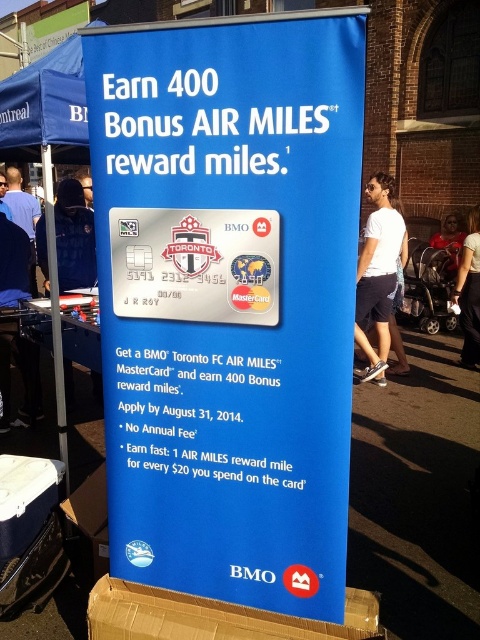
Who is positioned more to the left, black fabric at left or matte black hair at upper left?

From the viewer's perspective, matte black hair at upper left appears more on the left side.

Is black fabric at left positioned before matte black hair at upper left?

That is True.

Find the location of a particular element. This screenshot has height=640, width=480. black fabric at left is located at coordinates (73, 237).

Between metallic silver card at center and blue fabric canopy at upper left, which one is positioned lower?

metallic silver card at center

This screenshot has height=640, width=480. I want to click on metallic silver card at center, so click(x=195, y=264).

This screenshot has height=640, width=480. Find the location of `metallic silver card at center`. metallic silver card at center is located at coordinates pyautogui.click(x=195, y=264).

Is blue fabric canopy at upper left closer to the viewer compared to matte black jacket at left?

Yes.

Can you confirm if blue fabric canopy at upper left is bigger than matte black jacket at left?

No, blue fabric canopy at upper left is not bigger than matte black jacket at left.

You are a GUI agent. You are given a task and a screenshot of the screen. Output one action in this format:
    pyautogui.click(x=<x>, y=<y>)
    Task: Click on the blue fabric canopy at upper left
    The height and width of the screenshot is (640, 480).
    Given the screenshot: What is the action you would take?
    pyautogui.click(x=46, y=106)

I want to click on blue fabric canopy at upper left, so click(x=46, y=106).